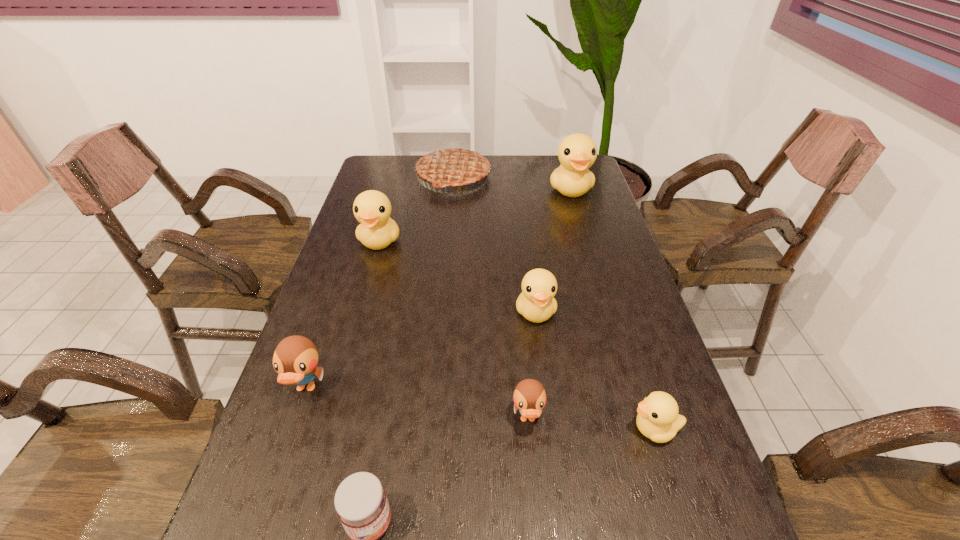
Find the location of a particular element. The image size is (960, 540). duck at the far edge is located at coordinates (577, 152).

The height and width of the screenshot is (540, 960). What are the coordinates of `object present at the far right corner` in the screenshot? It's located at (577, 152).

This screenshot has width=960, height=540. In the image, there is a desktop. Find the location of `free space at the far edge`. free space at the far edge is located at coordinates (495, 168).

Locate an element on the screen. vacant space at the left edge is located at coordinates (297, 483).

The image size is (960, 540). I want to click on free space at the right edge of the desktop, so click(x=667, y=374).

Locate an element on the screen. This screenshot has width=960, height=540. vacant area at the far left corner of the desktop is located at coordinates click(365, 178).

The height and width of the screenshot is (540, 960). I want to click on free spot between the second nearest yellow duck and the smaller blue duck, so click(532, 366).

I want to click on vacant space in between the bigger blue duck and the third farthest duck, so click(x=420, y=350).

In order to click on empty location between the pie and the smaller blue duck in this screenshot , I will do `click(491, 298)`.

This screenshot has width=960, height=540. What are the coordinates of `free spot between the smallest yellow duck and the third farthest duck` in the screenshot? It's located at (595, 370).